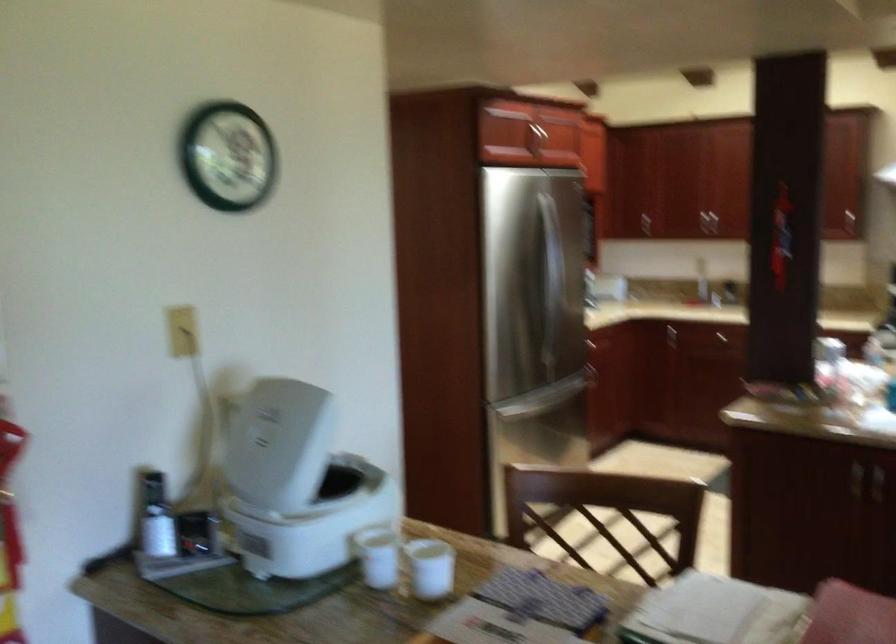
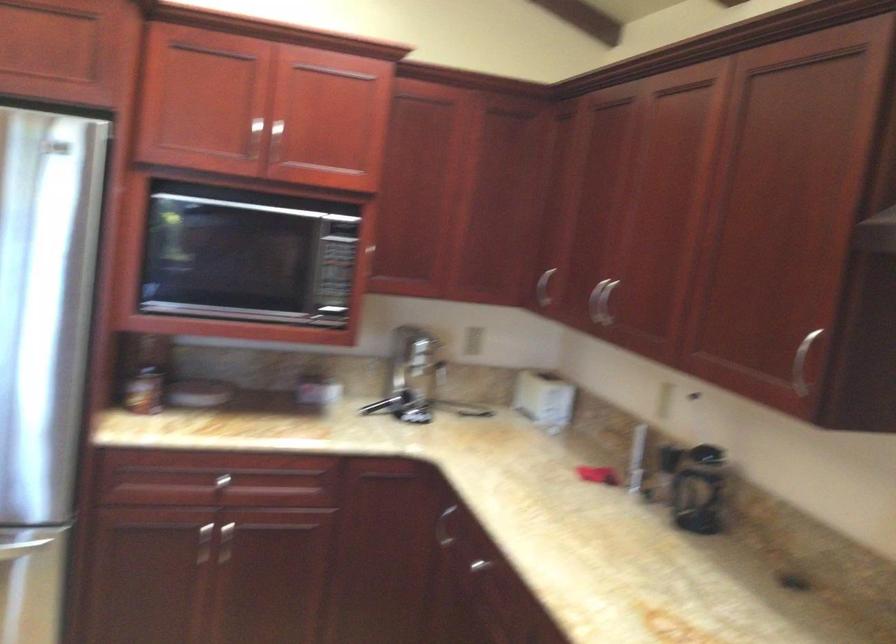
Locate, in the second image, the point that corresponds to point 712,314 in the first image.

(495, 567)